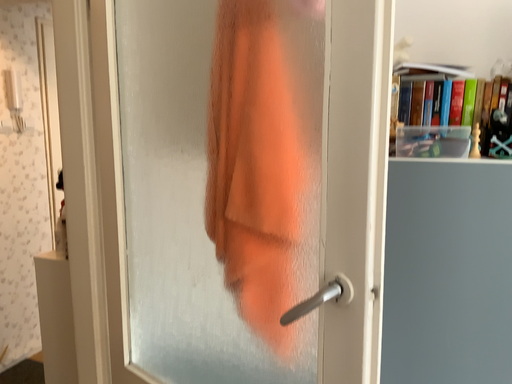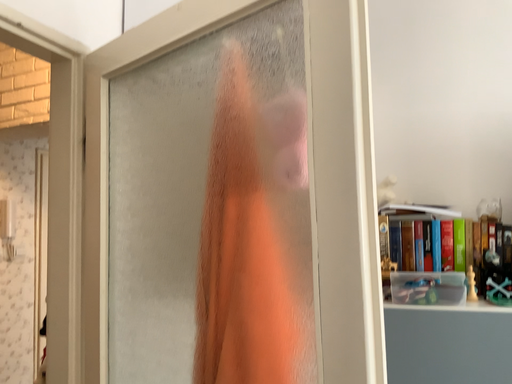
Question: Which way did the camera rotate in the video?

Choices:
 (A) rotated downward
 (B) rotated upward

Answer: (B)